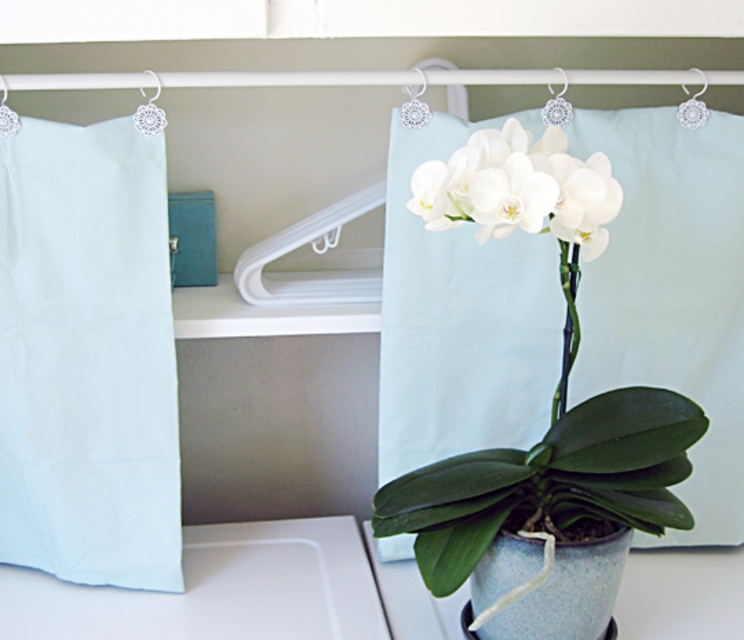
Does light blue fabric at left appear under white matte orchid at center?

Yes, light blue fabric at left is below white matte orchid at center.

Find the location of a particular element. The image size is (744, 640). light blue fabric at left is located at coordinates tap(86, 356).

The image size is (744, 640). I want to click on light blue fabric at left, so click(x=86, y=356).

Which is below, white matte orchid at center or white plastic hanger at upper left?

Positioned lower is white matte orchid at center.

Consider the image. Does white matte orchid at center appear over white plastic hanger at upper left?

Incorrect, white matte orchid at center is not positioned above white plastic hanger at upper left.

At what (x,y) coordinates should I click in order to perform the action: click on white matte orchid at center. Please return your answer as a coordinate pair (x, y). Looking at the image, I should click on (519, 188).

The width and height of the screenshot is (744, 640). Find the location of `white matte orchid at center`. white matte orchid at center is located at coordinates click(519, 188).

Between white matte orchid at center and speckled ceramic vase at center, which one is positioned higher?

white matte orchid at center is above.

Is white matte orchid at center to the right of speckled ceramic vase at center from the viewer's perspective?

Incorrect, white matte orchid at center is not on the right side of speckled ceramic vase at center.

Locate an element on the screen. white matte orchid at center is located at coordinates (519, 188).